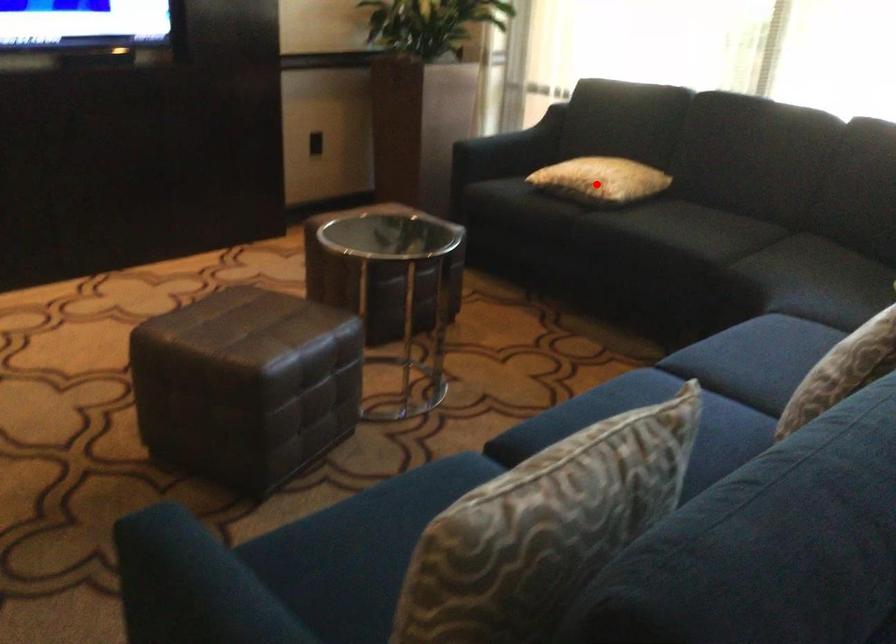
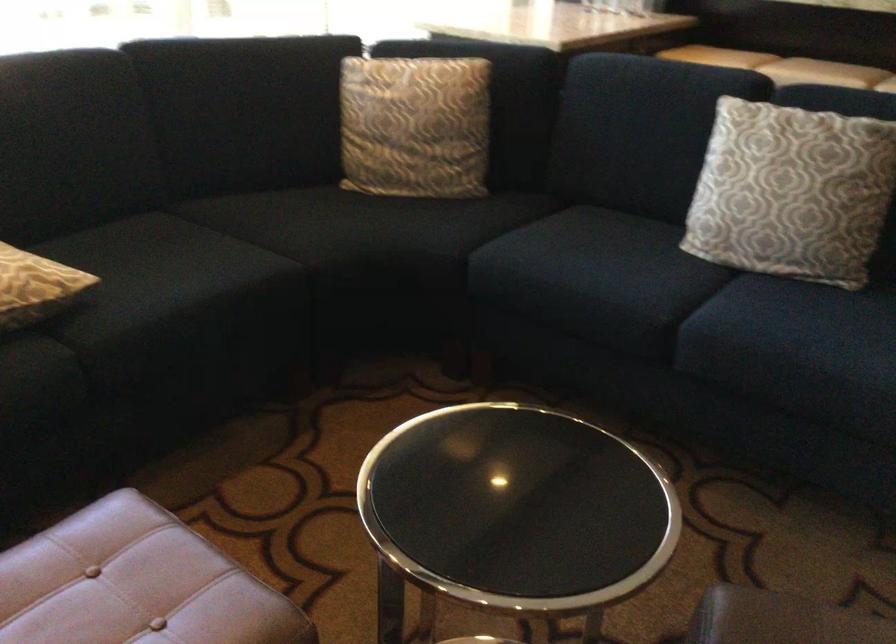
Question: I am providing you with two images of the same scene from different viewpoints. In image1, a red point is highlighted. Considering the same 3D point in image2, which of the following is correct?

Choices:
 (A) It is closer
 (B) It is farther

Answer: (A)